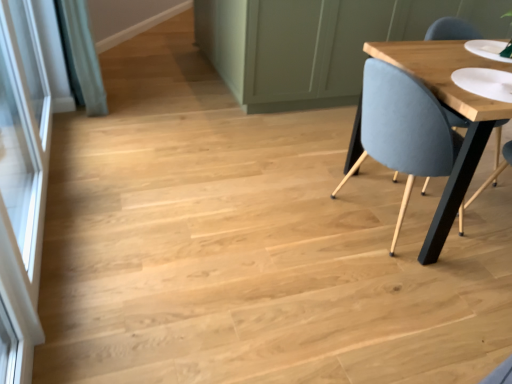
Question: Does light blue fabric chair at right touch transparent glass screen door at left?

Choices:
 (A) no
 (B) yes

Answer: (A)

Question: Is light blue fabric chair at right positioned beyond the bounds of transparent glass screen door at left?

Choices:
 (A) no
 (B) yes

Answer: (B)

Question: Does light blue fabric chair at right lie behind transparent glass screen door at left?

Choices:
 (A) yes
 (B) no

Answer: (A)

Question: Can you confirm if light blue fabric chair at right is thinner than transparent glass screen door at left?

Choices:
 (A) no
 (B) yes

Answer: (A)

Question: Is light blue fabric chair at right smaller than transparent glass screen door at left?

Choices:
 (A) no
 (B) yes

Answer: (A)

Question: Is the depth of light blue fabric chair at right less than that of transparent glass screen door at left?

Choices:
 (A) no
 (B) yes

Answer: (A)

Question: From the image's perspective, is transparent glass screen door at left on light blue fabric chair at right?

Choices:
 (A) yes
 (B) no

Answer: (B)

Question: Considering the relative sizes of transparent glass screen door at left and light blue fabric chair at right in the image provided, is transparent glass screen door at left taller than light blue fabric chair at right?

Choices:
 (A) no
 (B) yes

Answer: (B)

Question: From a real-world perspective, is transparent glass screen door at left over light blue fabric chair at right?

Choices:
 (A) no
 (B) yes

Answer: (B)

Question: Does transparent glass screen door at left have a larger size compared to light blue fabric chair at right?

Choices:
 (A) no
 (B) yes

Answer: (A)

Question: Is transparent glass screen door at left to the right of light blue fabric chair at right from the viewer's perspective?

Choices:
 (A) no
 (B) yes

Answer: (A)

Question: Is light blue fabric chair at right completely or partially inside transparent glass screen door at left?

Choices:
 (A) no
 (B) yes

Answer: (A)

Question: From the image's perspective, relative to transparent glass screen door at left, is light blue fabric chair at right above or below?

Choices:
 (A) above
 (B) below

Answer: (A)